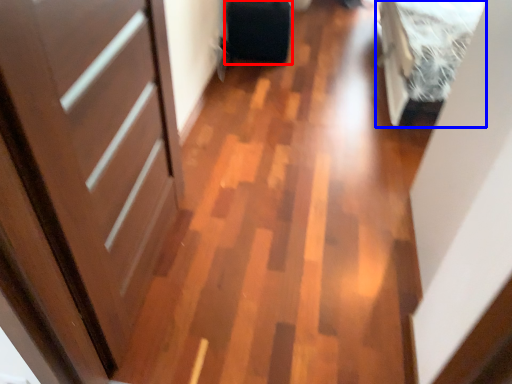
Question: Which object is closer to the camera taking this photo, luggage (highlighted by a red box) or bed (highlighted by a blue box)?

Choices:
 (A) luggage
 (B) bed

Answer: (B)